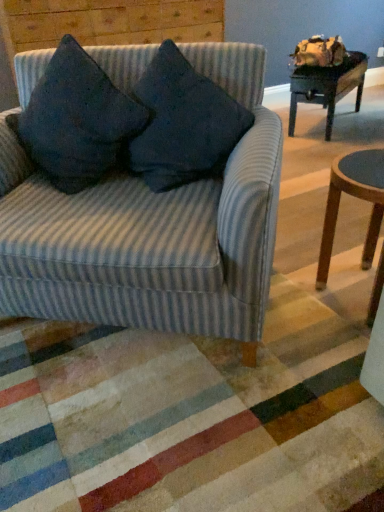
Image resolution: width=384 pixels, height=512 pixels. I want to click on blank area beneath wooden round stool at lower right (from a real-world perspective), so click(x=349, y=290).